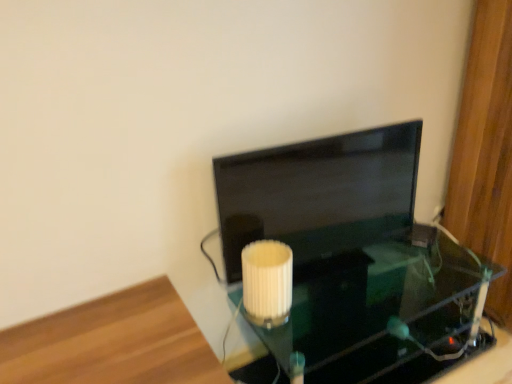
Question: Is wooden floor at lower left wider than matte black monitor at center?

Choices:
 (A) yes
 (B) no

Answer: (A)

Question: Is wooden floor at lower left facing towards matte black monitor at center?

Choices:
 (A) yes
 (B) no

Answer: (B)

Question: Can you see wooden floor at lower left touching matte black monitor at center?

Choices:
 (A) no
 (B) yes

Answer: (A)

Question: Would you say wooden floor at lower left is outside matte black monitor at center?

Choices:
 (A) yes
 (B) no

Answer: (A)

Question: From the image's perspective, is wooden floor at lower left on matte black monitor at center?

Choices:
 (A) no
 (B) yes

Answer: (A)

Question: From the image's perspective, would you say wooden floor at lower left is shown under matte black monitor at center?

Choices:
 (A) no
 (B) yes

Answer: (B)

Question: From the image's perspective, is matte black monitor at center above white ribbed lampshade at center?

Choices:
 (A) yes
 (B) no

Answer: (A)

Question: Can you confirm if matte black monitor at center is wider than white ribbed lampshade at center?

Choices:
 (A) no
 (B) yes

Answer: (A)

Question: Considering the relative sizes of matte black monitor at center and white ribbed lampshade at center in the image provided, is matte black monitor at center bigger than white ribbed lampshade at center?

Choices:
 (A) no
 (B) yes

Answer: (B)

Question: From a real-world perspective, does matte black monitor at center stand above white ribbed lampshade at center?

Choices:
 (A) no
 (B) yes

Answer: (B)

Question: Considering the relative positions of matte black monitor at center and white ribbed lampshade at center in the image provided, is matte black monitor at center behind white ribbed lampshade at center?

Choices:
 (A) yes
 (B) no

Answer: (A)

Question: Is matte black monitor at center positioned far away from white ribbed lampshade at center?

Choices:
 (A) no
 (B) yes

Answer: (A)

Question: Does white ribbed lampshade at center turn towards matte black monitor at center?

Choices:
 (A) yes
 (B) no

Answer: (B)